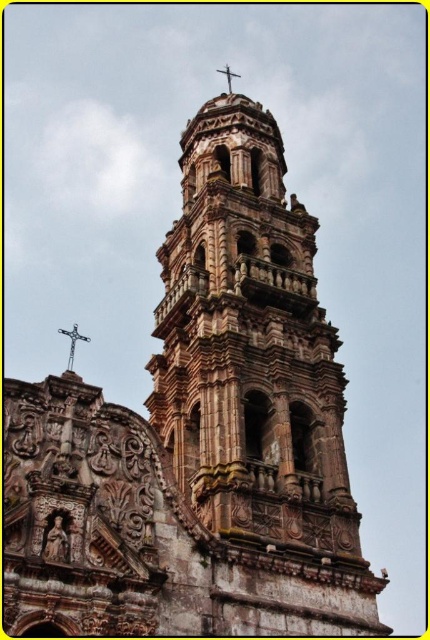
You are standing in front of the historic church and want to touch both the stone carved tower at center and the silver metallic cross at upper center. Which object would you need to reach higher to touch?

The silver metallic cross at upper center is higher than the stone carved tower at center, so you would need to reach higher to touch the silver metallic cross at upper center.

You are an architect visiting the church and need to determine the relative sizes of the two main features. Based on the image, which object is larger in size between the stone carved tower at center and the silver metallic cross at upper center?

The stone carved tower at center is bigger than the silver metallic cross at upper center, so the stone carved tower at center is larger in size.